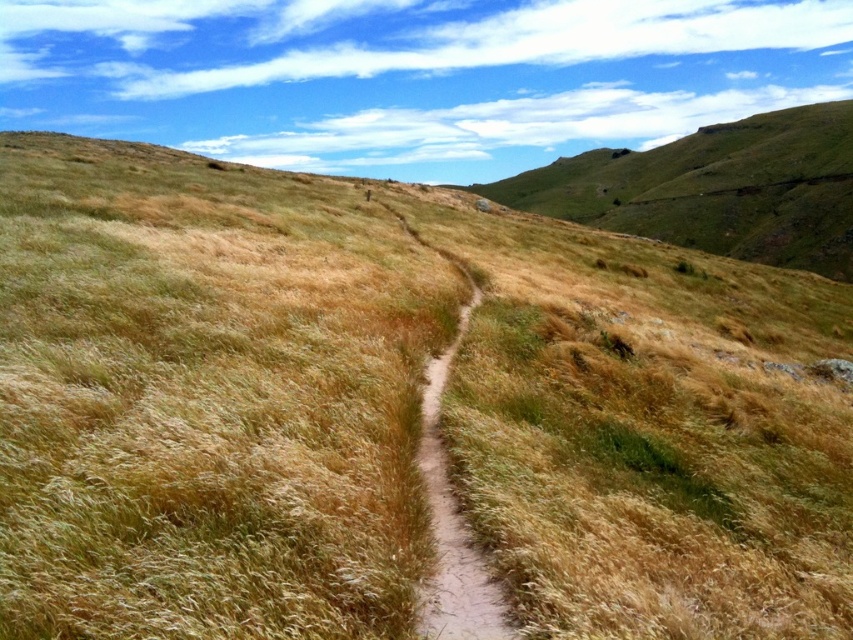
Question: Which point is farther from the camera taking this photo?

Choices:
 (A) (534, 177)
 (B) (465, 563)

Answer: (A)

Question: Can you confirm if green grassy hillside at upper right is positioned below brown dirt path at center?

Choices:
 (A) yes
 (B) no

Answer: (B)

Question: Is green grassy hillside at upper right thinner than brown dirt path at center?

Choices:
 (A) yes
 (B) no

Answer: (B)

Question: Does green grassy hillside at upper right have a greater width compared to brown dirt path at center?

Choices:
 (A) yes
 (B) no

Answer: (A)